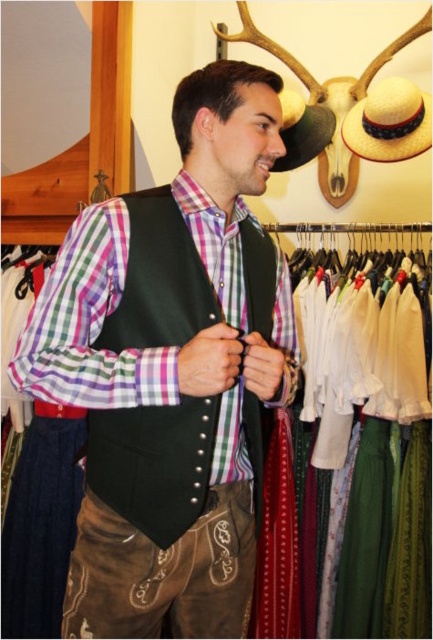
Question: Which point is farther to the camera?

Choices:
 (A) natural straw hat at upper right
 (B) matte black vest at center

Answer: (A)

Question: Can you confirm if matte black vest at center is thinner than natural straw hat at upper right?

Choices:
 (A) no
 (B) yes

Answer: (A)

Question: Which point is farther from the camera taking this photo?

Choices:
 (A) (225, 264)
 (B) (430, 113)
 (C) (132, 259)

Answer: (B)

Question: Can you confirm if matte black vest at center is thinner than natural straw hat at upper right?

Choices:
 (A) no
 (B) yes

Answer: (A)

Question: Which object appears closest to the camera in this image?

Choices:
 (A) natural straw hat at upper right
 (B) black leather vest at center

Answer: (B)

Question: Can you confirm if matte black vest at center is positioned below black leather vest at center?

Choices:
 (A) no
 (B) yes

Answer: (A)